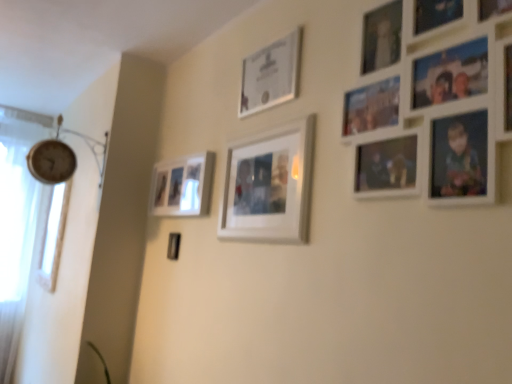
Question: Is white matte picture frame at center, positioned as the third picture frame in right-to-left order, at the back of matte white picture frame at center left, which is counted as the fourth picture frame, starting from the right?

Choices:
 (A) no
 (B) yes

Answer: (A)

Question: From the image's perspective, would you say matte white picture frame at center left, which is counted as the fourth picture frame, starting from the right, is shown under white matte picture frame at center, which is counted as the second picture frame, starting from the front?

Choices:
 (A) no
 (B) yes

Answer: (B)

Question: From the image's perspective, is matte white picture frame at center left, which is counted as the fourth picture frame, starting from the front, on top of white matte picture frame at center, arranged as the 2th picture frame when viewed from the left?

Choices:
 (A) yes
 (B) no

Answer: (B)

Question: Considering the relative positions of matte white picture frame at center left, which is counted as the fourth picture frame, starting from the front, and white matte picture frame at center, positioned as the third picture frame in right-to-left order, in the image provided, is matte white picture frame at center left, which is counted as the fourth picture frame, starting from the front, to the right of white matte picture frame at center, positioned as the third picture frame in right-to-left order, from the viewer's perspective?

Choices:
 (A) no
 (B) yes

Answer: (A)

Question: Is matte white picture frame at center left, the first picture frame in the back-to-front sequence, to the left of white matte picture frame at center, arranged as the 2th picture frame when viewed from the left, from the viewer's perspective?

Choices:
 (A) yes
 (B) no

Answer: (A)

Question: From the image's perspective, is matte silver frame at upper center, marked as the third picture frame in a front-to-back arrangement, located above or below white matte picture frame at center, arranged as the 2th picture frame when viewed from the left?

Choices:
 (A) below
 (B) above

Answer: (B)

Question: From a real-world perspective, is matte silver frame at upper center, placed as the 2th picture frame when sorted from back to front, above or below white matte picture frame at center, arranged as the 2th picture frame when viewed from the left?

Choices:
 (A) below
 (B) above

Answer: (B)

Question: Considering the positions of matte silver frame at upper center, placed as the 2th picture frame when sorted from back to front, and white matte picture frame at center, positioned as the third picture frame in right-to-left order, in the image, is matte silver frame at upper center, placed as the 2th picture frame when sorted from back to front, wider or thinner than white matte picture frame at center, positioned as the third picture frame in right-to-left order,?

Choices:
 (A) thin
 (B) wide

Answer: (A)

Question: Considering the relative positions of matte silver frame at upper center, placed as the 3th picture frame when sorted from left to right, and white matte picture frame at center, which is counted as the second picture frame, starting from the front, in the image provided, is matte silver frame at upper center, placed as the 3th picture frame when sorted from left to right, to the left or to the right of white matte picture frame at center, which is counted as the second picture frame, starting from the front,?

Choices:
 (A) left
 (B) right

Answer: (B)

Question: From the image's perspective, is white matte picture frame at center, positioned as the third picture frame in right-to-left order, located above or below clear glass window at left?

Choices:
 (A) above
 (B) below

Answer: (A)

Question: Is white matte picture frame at center, positioned as the third picture frame in right-to-left order, bigger or smaller than clear glass window at left?

Choices:
 (A) small
 (B) big

Answer: (A)

Question: From their relative heights in the image, would you say white matte picture frame at center, the 3th picture frame when ordered from back to front, is taller or shorter than clear glass window at left?

Choices:
 (A) short
 (B) tall

Answer: (A)

Question: Is white matte picture frame at center, the 3th picture frame when ordered from back to front, inside the boundaries of clear glass window at left, or outside?

Choices:
 (A) outside
 (B) inside

Answer: (A)

Question: Is matte silver frame at upper center, marked as the third picture frame in a front-to-back arrangement, bigger or smaller than clear glass window at left?

Choices:
 (A) small
 (B) big

Answer: (A)

Question: In the image, is matte silver frame at upper center, which ranks as the second picture frame in right-to-left order, positioned in front of or behind clear glass window at left?

Choices:
 (A) front
 (B) behind

Answer: (A)